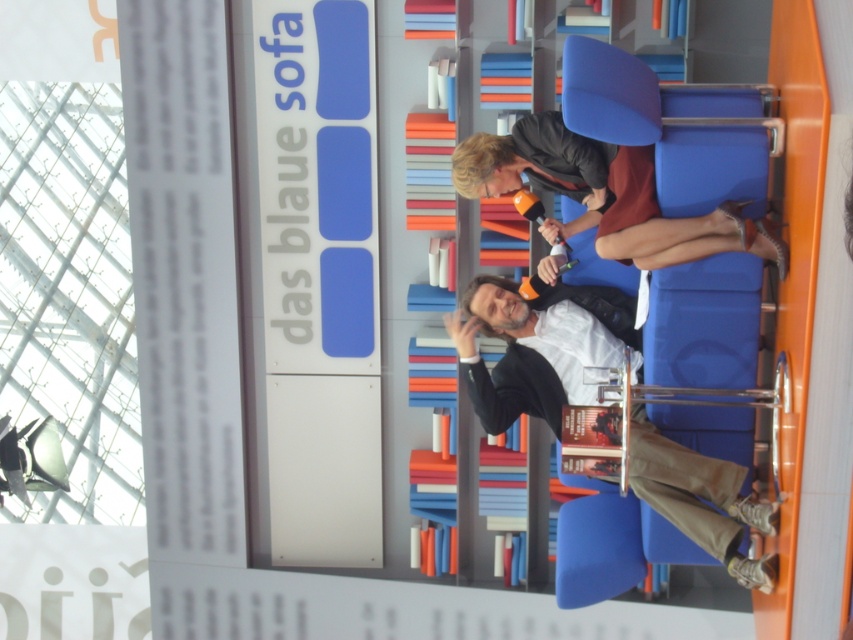
Question: Which point is closer to the camera taking this photo?

Choices:
 (A) (554, 22)
 (B) (456, 323)

Answer: (B)

Question: Does stacked books at center appear under matte black jacket at upper center?

Choices:
 (A) yes
 (B) no

Answer: (B)

Question: Considering the real-world distances, which object is farthest from the matte black jacket at center?

Choices:
 (A) matte black jacket at upper center
 (B) stacked books at center

Answer: (B)

Question: Which point is farther to the camera?

Choices:
 (A) matte black jacket at center
 (B) matte black jacket at upper center
 (C) stacked books at center

Answer: (C)

Question: Is matte black jacket at center positioned before matte black jacket at upper center?

Choices:
 (A) yes
 (B) no

Answer: (B)

Question: Can you confirm if matte black jacket at center is thinner than matte black jacket at upper center?

Choices:
 (A) no
 (B) yes

Answer: (B)